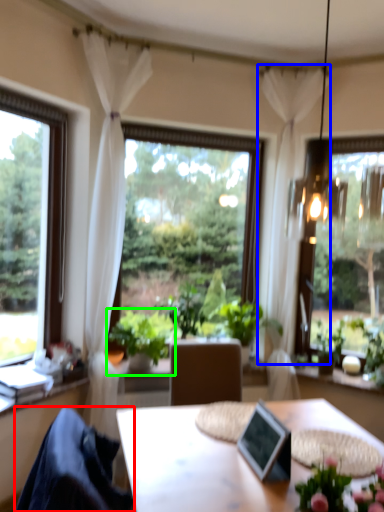
Question: Considering the real-world distances, which object is farthest from chair (highlighted by a red box)? curtain (highlighted by a blue box) or houseplant (highlighted by a green box)?

Choices:
 (A) curtain
 (B) houseplant

Answer: (A)